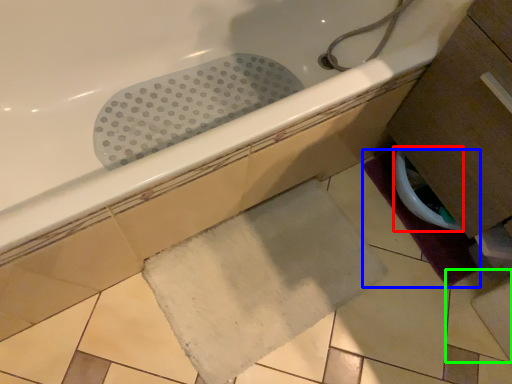
Question: Considering the real-world distances, which object is farthest from toilet bowl (highlighted by a red box)? bath mat (highlighted by a blue box) or ceramic tile (highlighted by a green box)?

Choices:
 (A) bath mat
 (B) ceramic tile

Answer: (B)